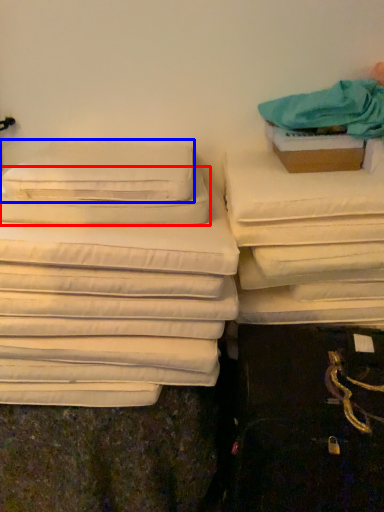
Question: Which of the following is the closest to the observer, pillow (highlighted by a red box) or pillow (highlighted by a blue box)?

Choices:
 (A) pillow
 (B) pillow

Answer: (A)